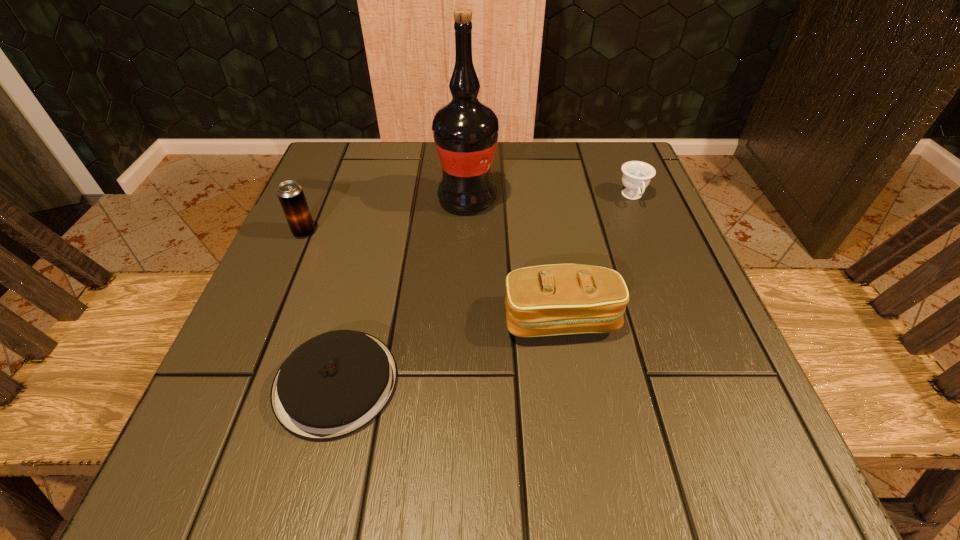
Find the location of a particular element. Image resolution: width=960 pixels, height=540 pixels. the third object from left to right is located at coordinates (465, 131).

Image resolution: width=960 pixels, height=540 pixels. In order to click on wine bottle in this screenshot , I will do `click(465, 131)`.

This screenshot has width=960, height=540. Identify the location of the third farthest object. (290, 194).

Find the location of a particular element. This screenshot has width=960, height=540. the fourth shortest object is located at coordinates (290, 194).

Find the location of `the third shortest object`. the third shortest object is located at coordinates (559, 299).

Image resolution: width=960 pixels, height=540 pixels. What are the coordinates of `clutch bag` in the screenshot? It's located at (559, 299).

You are a GUI agent. You are given a task and a screenshot of the screen. Output one action in this format:
    pyautogui.click(x=<x>, y=<y>)
    Task: Click on the teacup
    This screenshot has width=960, height=540.
    Given the screenshot: What is the action you would take?
    pyautogui.click(x=636, y=176)

Find the location of a particular element. the second shortest object is located at coordinates (636, 176).

Identify the location of the fourth object from right to left. (332, 385).

Locate an element on the screen. The width and height of the screenshot is (960, 540). pancake is located at coordinates (332, 385).